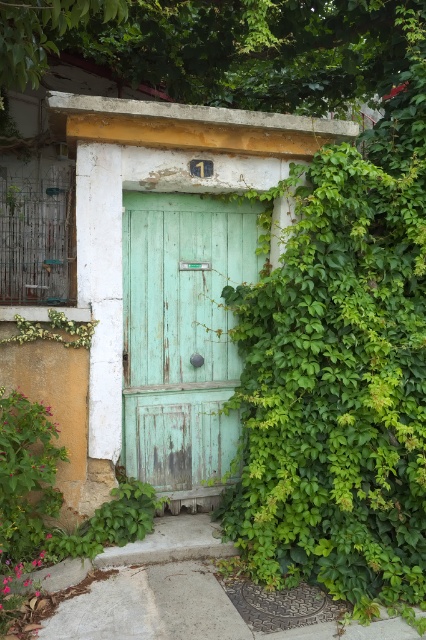
Question: Is green wooden door at center below green matte door at center?

Choices:
 (A) no
 (B) yes

Answer: (A)

Question: Which object appears closest to the camera in this image?

Choices:
 (A) green matte door at center
 (B) green wooden door at center

Answer: (B)

Question: Which of the following is the closest to the observer?

Choices:
 (A) (178, 372)
 (B) (193, 124)

Answer: (B)

Question: Is green wooden door at center to the right of green matte door at center from the viewer's perspective?

Choices:
 (A) no
 (B) yes

Answer: (A)

Question: Can you confirm if green wooden door at center is wider than green matte door at center?

Choices:
 (A) yes
 (B) no

Answer: (A)